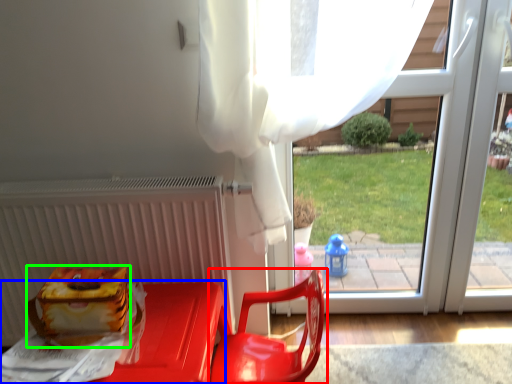
Question: Which object is the farthest from chair (highlighted by a red box)? Choose among these: furniture (highlighted by a blue box) or lunch box (highlighted by a green box).

Choices:
 (A) furniture
 (B) lunch box

Answer: (B)